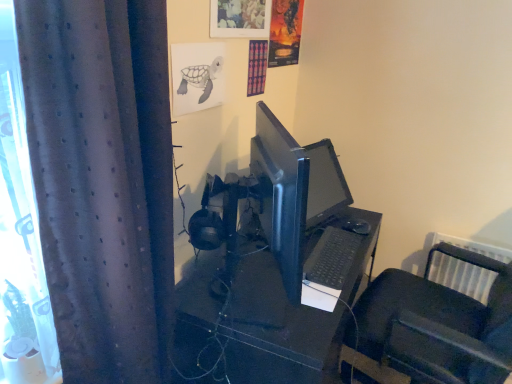
Question: Should I look upward or downward to see black plastic desk at center?

Choices:
 (A) down
 (B) up

Answer: (A)

Question: Should I look upward or downward to see dark grey textured curtain at left?

Choices:
 (A) up
 (B) down

Answer: (B)

Question: Is black plastic desk at center looking in the opposite direction of black matte keyboard at center?

Choices:
 (A) no
 (B) yes

Answer: (A)

Question: Does black plastic desk at center lie behind black matte keyboard at center?

Choices:
 (A) no
 (B) yes

Answer: (A)

Question: Is black plastic desk at center positioned in front of black matte keyboard at center?

Choices:
 (A) no
 (B) yes

Answer: (B)

Question: From a real-world perspective, is black plastic desk at center located higher than black matte keyboard at center?

Choices:
 (A) yes
 (B) no

Answer: (B)

Question: Is black plastic desk at center far away from black matte keyboard at center?

Choices:
 (A) yes
 (B) no

Answer: (B)

Question: Is the surface of black plastic desk at center in direct contact with black matte keyboard at center?

Choices:
 (A) no
 (B) yes

Answer: (A)

Question: Does black matte keyboard at center have a lesser width compared to dark grey textured curtain at left?

Choices:
 (A) yes
 (B) no

Answer: (A)

Question: Is black matte keyboard at center behind dark grey textured curtain at left?

Choices:
 (A) yes
 (B) no

Answer: (A)

Question: Is black matte keyboard at center positioned in front of dark grey textured curtain at left?

Choices:
 (A) yes
 (B) no

Answer: (B)

Question: Considering the relative sizes of black matte keyboard at center and dark grey textured curtain at left in the image provided, is black matte keyboard at center shorter than dark grey textured curtain at left?

Choices:
 (A) yes
 (B) no

Answer: (A)

Question: Would you say black matte keyboard at center contains dark grey textured curtain at left?

Choices:
 (A) no
 (B) yes

Answer: (A)

Question: Can you confirm if black matte keyboard at center is taller than dark grey textured curtain at left?

Choices:
 (A) no
 (B) yes

Answer: (A)

Question: Is black matte keyboard at center completely or partially outside of black plastic desk at center?

Choices:
 (A) no
 (B) yes

Answer: (B)